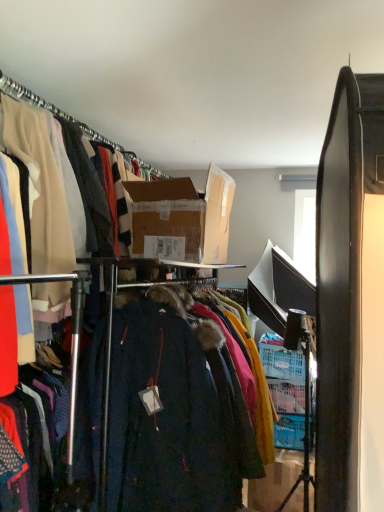
Question: From a real-world perspective, is brown cardboard box at center, which ranks as the 2th box in right-to-left order, located higher than cardboard box at center, acting as the first box starting from the right?

Choices:
 (A) yes
 (B) no

Answer: (A)

Question: From the image's perspective, is brown cardboard box at center, which ranks as the 2th box in right-to-left order, on top of cardboard box at center, arranged as the second box when viewed from the front?

Choices:
 (A) yes
 (B) no

Answer: (A)

Question: Is cardboard box at center, arranged as the second box when viewed from the front, inside brown cardboard box at center, which is the first box from left to right?

Choices:
 (A) no
 (B) yes

Answer: (A)

Question: Is brown cardboard box at center, the first box viewed from the front, not near cardboard box at center, arranged as the second box when viewed from the front?

Choices:
 (A) yes
 (B) no

Answer: (A)

Question: Considering the relative positions of brown cardboard box at center, which is the first box from left to right, and cardboard box at center, which ranks as the second box in top-to-bottom order, in the image provided, is brown cardboard box at center, which is the first box from left to right, behind cardboard box at center, which ranks as the second box in top-to-bottom order,?

Choices:
 (A) no
 (B) yes

Answer: (A)

Question: Does brown cardboard box at center, which ranks as the 2th box in right-to-left order, have a lesser height compared to cardboard box at center, acting as the first box starting from the right?

Choices:
 (A) no
 (B) yes

Answer: (B)

Question: Does velvet dark coat at center appear on the right side of cardboard box at center, which is the 1th box from back to front?

Choices:
 (A) yes
 (B) no

Answer: (B)

Question: Is there a large distance between velvet dark coat at center and cardboard box at center, which ranks as the 1th box in bottom-to-top order?

Choices:
 (A) no
 (B) yes

Answer: (B)

Question: Is velvet dark coat at center further to camera compared to cardboard box at center, placed as the 2th box when sorted from left to right?

Choices:
 (A) yes
 (B) no

Answer: (B)

Question: Could you tell me if velvet dark coat at center is turned towards cardboard box at center, which is the 1th box from back to front?

Choices:
 (A) no
 (B) yes

Answer: (A)

Question: Can you confirm if velvet dark coat at center is wider than cardboard box at center, which is the 1th box from back to front?

Choices:
 (A) yes
 (B) no

Answer: (B)

Question: Is velvet dark coat at center positioned in front of cardboard box at center, placed as the 2th box when sorted from left to right?

Choices:
 (A) yes
 (B) no

Answer: (A)

Question: Can you confirm if cardboard box at center, acting as the first box starting from the right, is wider than velvet dark coat at center?

Choices:
 (A) yes
 (B) no

Answer: (A)